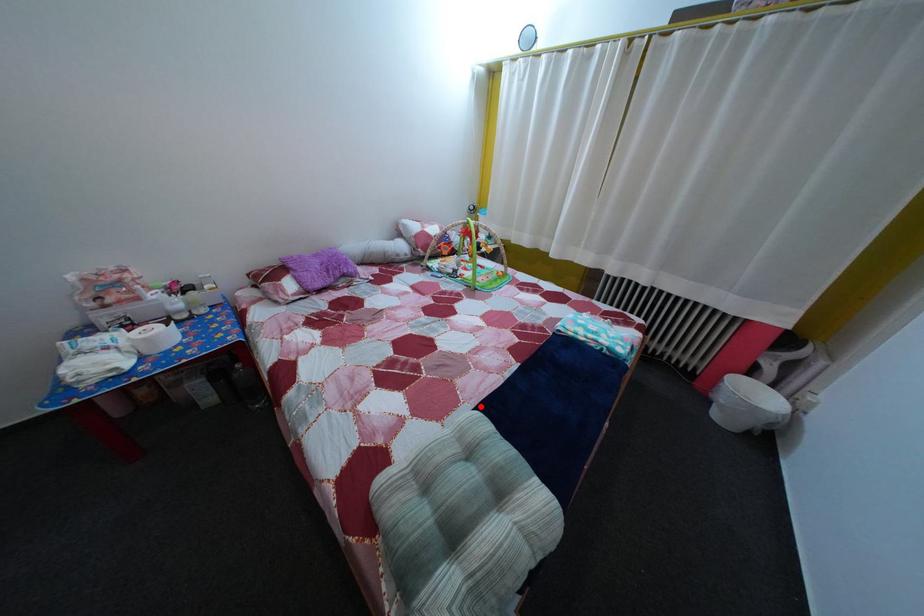
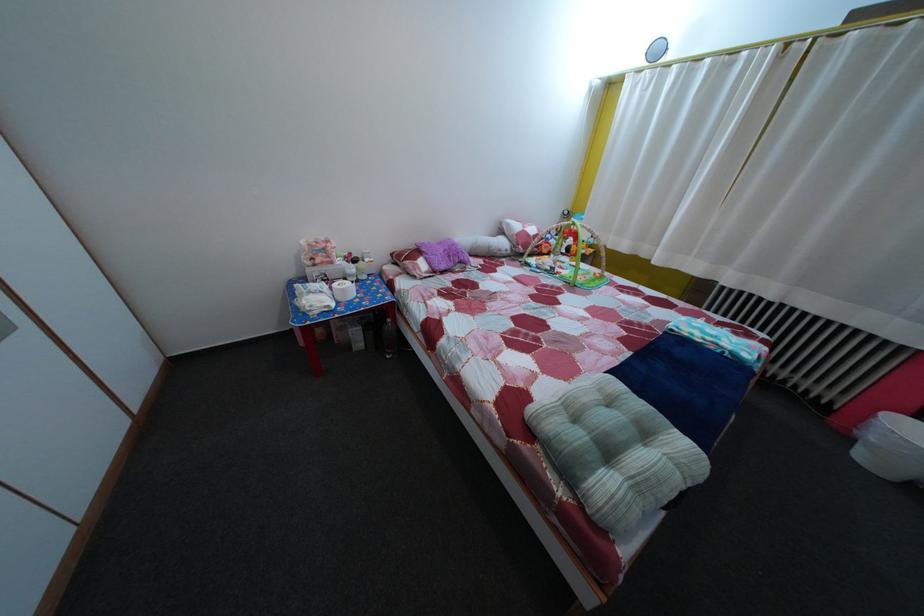
In the second image, find the point that corresponds to the highlighted location in the first image.

(601, 379)